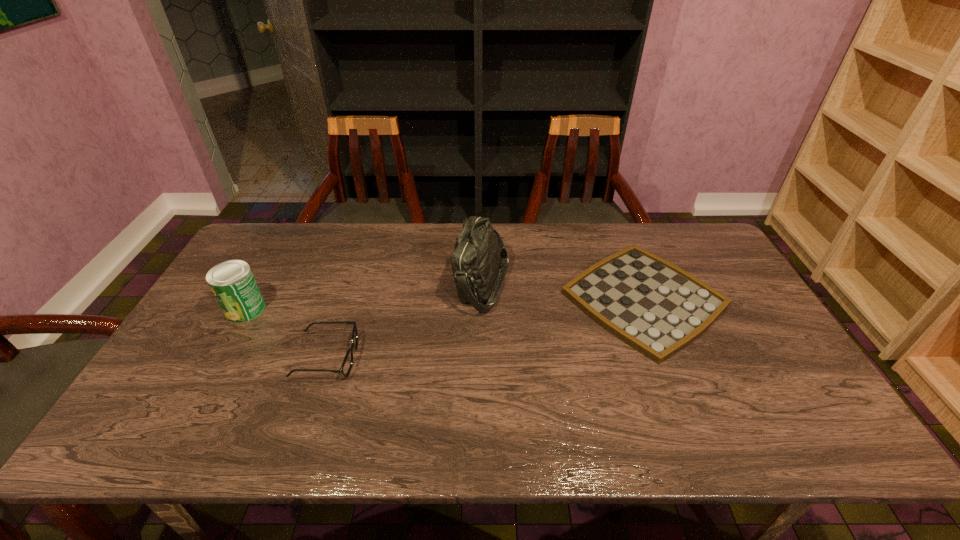
Find the location of a particular element. Image resolution: width=960 pixels, height=540 pixels. free space that satisfies the following two spatial constraints: 1. on the front side of the rightmost object; 2. on the front-facing side of the spectacles is located at coordinates (667, 357).